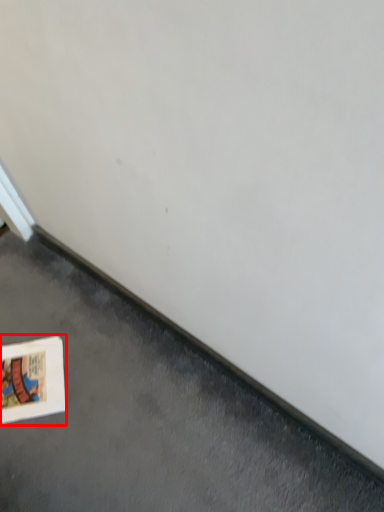
Question: From the image's perspective, what is the correct spatial positioning of picture frame (annotated by the red box) in reference to concrete?

Choices:
 (A) below
 (B) above

Answer: (B)